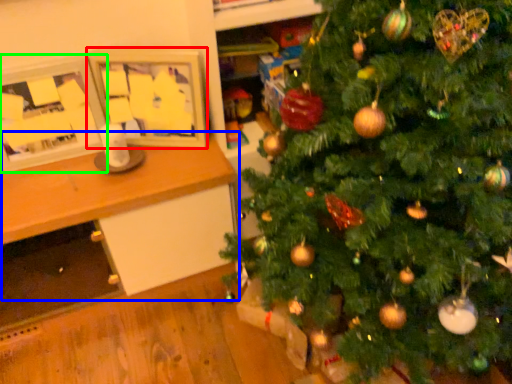
Question: Considering the real-world distances, which object is farthest from picture frame (highlighted by a red box)? table (highlighted by a blue box) or picture frame (highlighted by a green box)?

Choices:
 (A) table
 (B) picture frame

Answer: (A)